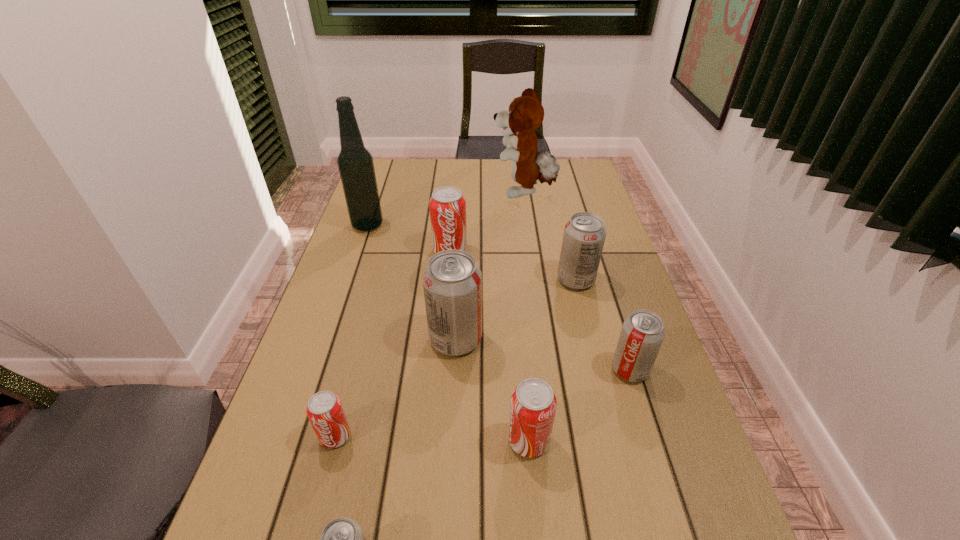
Locate an element on the screen. This screenshot has height=540, width=960. the third biggest gray soda can is located at coordinates (642, 334).

Image resolution: width=960 pixels, height=540 pixels. I want to click on the fifth soda can from left to right, so click(x=533, y=406).

Identify the location of the rightmost red soda can. Image resolution: width=960 pixels, height=540 pixels. (533, 406).

Find the location of a particular element. the leftmost red soda can is located at coordinates (324, 410).

Find the location of a particular element. the leftmost soda can is located at coordinates (324, 410).

The height and width of the screenshot is (540, 960). I want to click on vacant space located 0.120m on the back of the green alcohol, so click(377, 198).

I want to click on free region located on the face of the puppy, so click(402, 192).

Where is `vacant area situated 0.220m on the face of the puppy`? The width and height of the screenshot is (960, 540). vacant area situated 0.220m on the face of the puppy is located at coordinates (430, 192).

Find the location of a particular element. free space located 0.230m on the face of the puppy is located at coordinates (427, 192).

Find the location of a particular element. free point located 0.270m on the front of the biggest gray soda can is located at coordinates (448, 478).